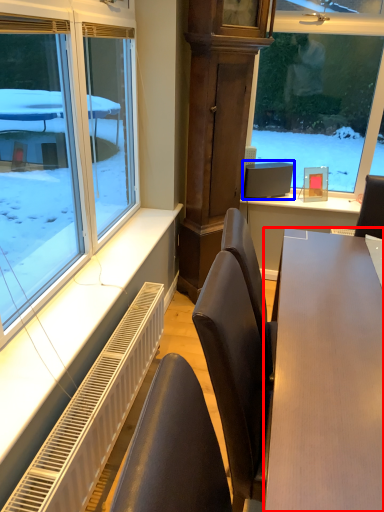
Question: Among these objects, which one is farthest to the camera, table (highlighted by a red box) or computer monitor (highlighted by a blue box)?

Choices:
 (A) table
 (B) computer monitor

Answer: (B)